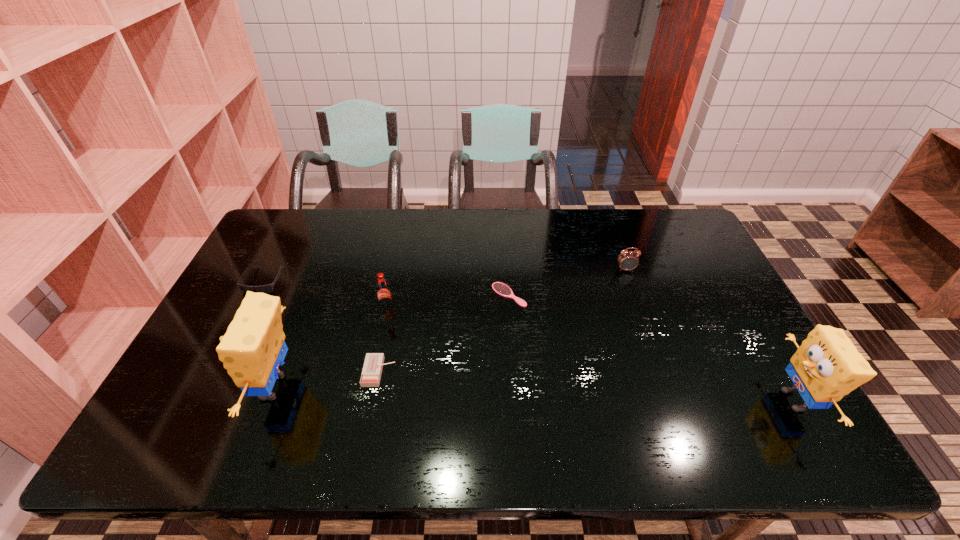
The width and height of the screenshot is (960, 540). Identify the location of free space located on the right of the hairbrush. (552, 295).

At what (x,y) coordinates should I click in order to perform the action: click on free region located 0.320m on the right of the root beer. Please return your answer as a coordinate pair (x, y). Image resolution: width=960 pixels, height=540 pixels. Looking at the image, I should click on (502, 309).

The width and height of the screenshot is (960, 540). I want to click on vacant area situated 0.390m on the striking surface of the second shortest object, so click(x=545, y=372).

This screenshot has width=960, height=540. What are the coordinates of `matchbox located at the near edge` in the screenshot? It's located at (371, 374).

Where is `object at the left edge`? object at the left edge is located at coordinates (268, 288).

Where is `object located at the right edge`? The height and width of the screenshot is (540, 960). object located at the right edge is located at coordinates (827, 366).

Find the location of a particular element. The height and width of the screenshot is (540, 960). object present at the near right corner is located at coordinates (827, 366).

The height and width of the screenshot is (540, 960). Find the location of `vacant position at the far edge of the desktop`. vacant position at the far edge of the desktop is located at coordinates (347, 223).

Identify the location of free space at the near edge of the desktop. This screenshot has width=960, height=540. (468, 411).

Identify the location of vacant space at the left edge. (204, 375).